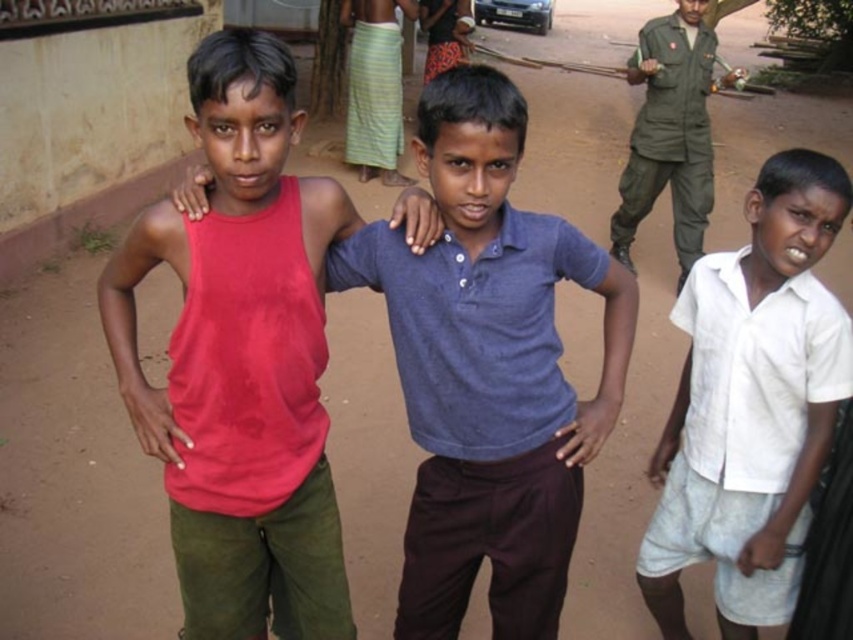
Can you confirm if matte red tank top at center is bigger than blue cotton shirt at center?

Correct, matte red tank top at center is larger in size than blue cotton shirt at center.

Does matte red tank top at center have a lesser height compared to blue cotton shirt at center?

No, matte red tank top at center is not shorter than blue cotton shirt at center.

Image resolution: width=853 pixels, height=640 pixels. Find the location of `matte red tank top at center`. matte red tank top at center is located at coordinates pos(241,358).

Where is `matte red tank top at center`? The height and width of the screenshot is (640, 853). matte red tank top at center is located at coordinates (241, 358).

Between point (434, 134) and point (685, 160), which one is positioned behind?

The point (685, 160) is more distant.

The height and width of the screenshot is (640, 853). What do you see at coordinates (488, 369) in the screenshot?
I see `blue cotton shirt at center` at bounding box center [488, 369].

The height and width of the screenshot is (640, 853). Identify the location of blue cotton shirt at center. (488, 369).

Does matte red tank top at center appear under green uniform at upper right?

A: Correct, matte red tank top at center is located below green uniform at upper right.

Who is more forward, (201, 48) or (708, 74)?

Point (201, 48)

This screenshot has width=853, height=640. I want to click on matte red tank top at center, so click(x=241, y=358).